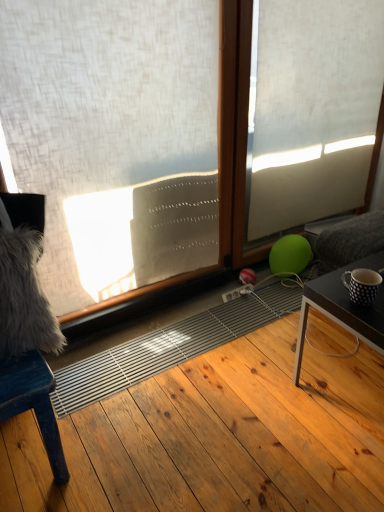
Question: Looking at their shapes, would you say wooden chair at left is wider or thinner than wooden frame at center?

Choices:
 (A) wide
 (B) thin

Answer: (A)

Question: Is wooden chair at left in front of or behind wooden frame at center in the image?

Choices:
 (A) behind
 (B) front

Answer: (B)

Question: Estimate the real-world distances between objects in this image. Which object is farther from the polka dot ceramic mug at right?

Choices:
 (A) natural wood floor at center
 (B) wooden frame at center
 (C) white textured curtain at upper left
 (D) wooden chair at left
 (E) dark brown wooden table at lower right

Answer: (B)

Question: Estimate the real-world distances between objects in this image. Which object is closer to the polka dot ceramic mug at right?

Choices:
 (A) natural wood floor at center
 (B) wooden frame at center
 (C) white textured curtain at upper left
 (D) wooden chair at left
 (E) dark brown wooden table at lower right

Answer: (E)